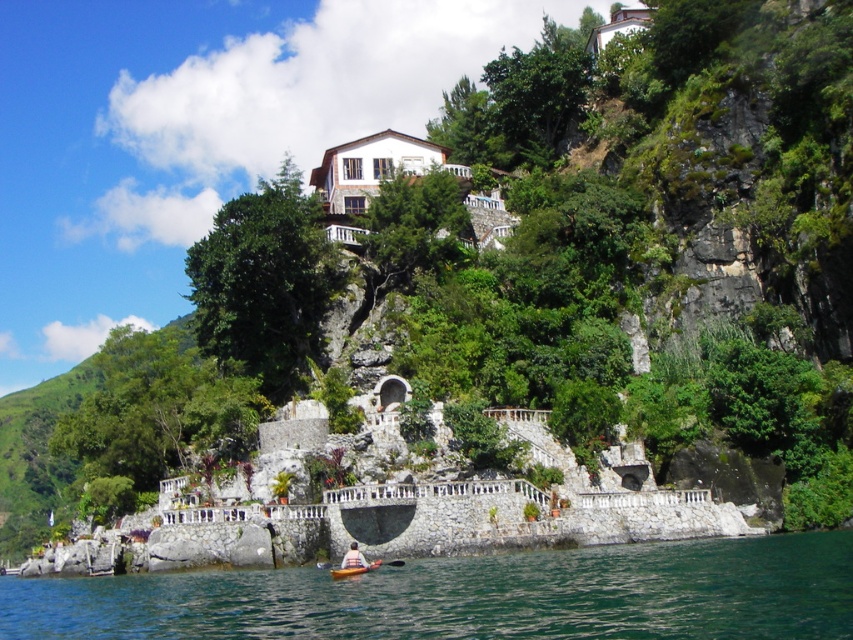
You are planning to store the matte yellow kayak at lower center and the white plastic paddle at lower center in a storage shed. Given their sizes, which one will require more space?

The matte yellow kayak at lower center requires more space because it is larger in size than the white plastic paddle at lower center.

You are standing on the lakeside dock and see the green water at lower center and the matte yellow kayak at lower center. Which object is closer to your left side?

The green water at lower center is closer to your left side because it is positioned to the left of the matte yellow kayak at lower center.